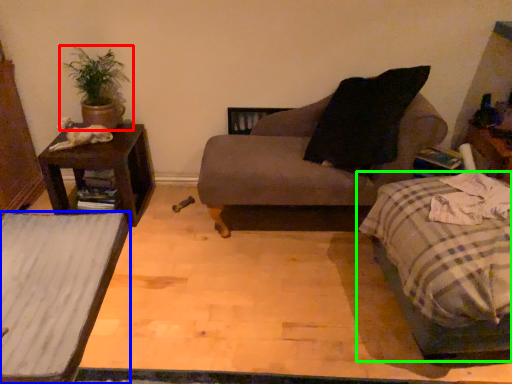
Question: Which object is the closest to the houseplant (highlighted by a red box)? Choose among these: table (highlighted by a blue box) or bed (highlighted by a green box).

Choices:
 (A) table
 (B) bed

Answer: (A)